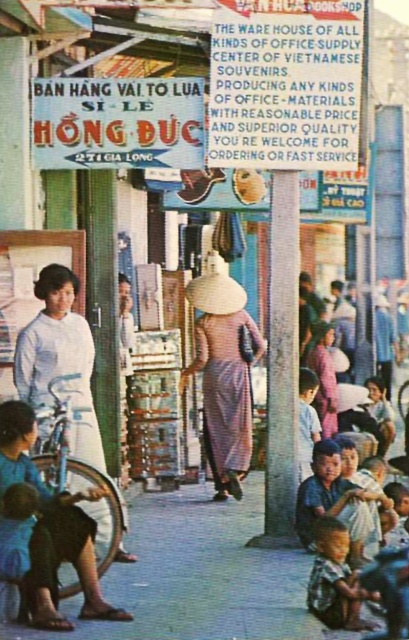
Question: Which of the following is the closest to the observer?

Choices:
 (A) (220, 278)
 (B) (337, 625)
 (C) (42, 269)
 (D) (22, 573)

Answer: (D)

Question: Can you confirm if matte purple dress at center is bigger than white silk ao dai at center?

Choices:
 (A) no
 (B) yes

Answer: (B)

Question: Can you confirm if matte purple dress at center is bigger than white silk ao dai at center?

Choices:
 (A) no
 (B) yes

Answer: (B)

Question: Considering the real-world distances, which object is farthest from the blue cotton shirt at lower left?

Choices:
 (A) light brown skin child at lower right
 (B) matte purple dress at center

Answer: (B)

Question: Does blue cotton shirt at lower left appear on the left side of light brown skin child at lower right?

Choices:
 (A) no
 (B) yes

Answer: (B)

Question: Which is farther from the blue cotton shirt at lower left?

Choices:
 (A) white silk ao dai at center
 (B) matte purple dress at center
 (C) light brown skin child at lower right

Answer: (B)